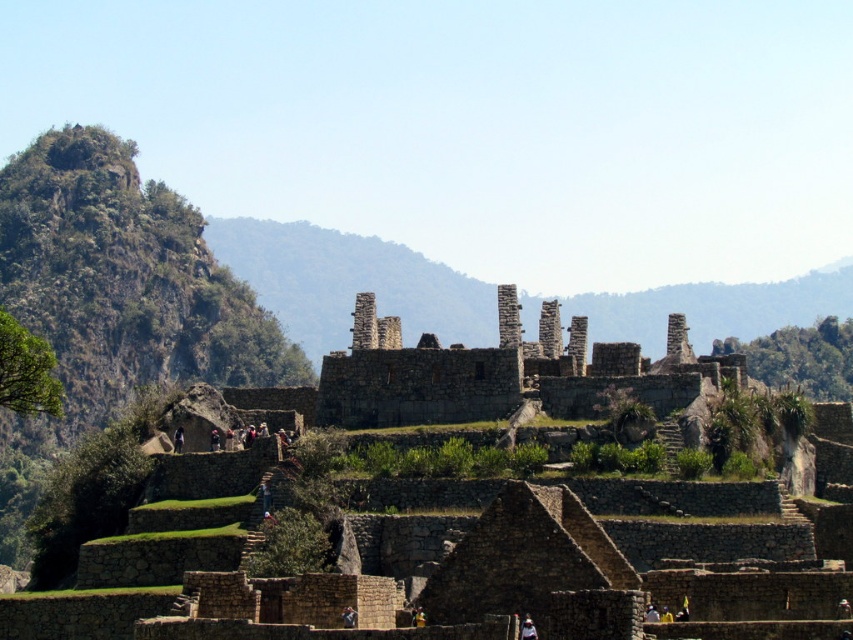
Question: Which object appears farthest from the camera in this image?

Choices:
 (A) stone ruins at center
 (B) green rocky mountain at upper left

Answer: (B)

Question: Is green rocky mountain at upper left below stone ruins at center?

Choices:
 (A) yes
 (B) no

Answer: (A)

Question: Among these points, which one is farthest from the camera?

Choices:
 (A) click(x=381, y=394)
 (B) click(x=97, y=195)

Answer: (B)

Question: Is green rocky mountain at upper left further to camera compared to stone ruins at center?

Choices:
 (A) yes
 (B) no

Answer: (A)

Question: Among these points, which one is nearest to the camera?

Choices:
 (A) (442, 403)
 (B) (67, 221)

Answer: (A)

Question: Is green rocky mountain at upper left to the left of stone ruins at center from the viewer's perspective?

Choices:
 (A) no
 (B) yes

Answer: (B)